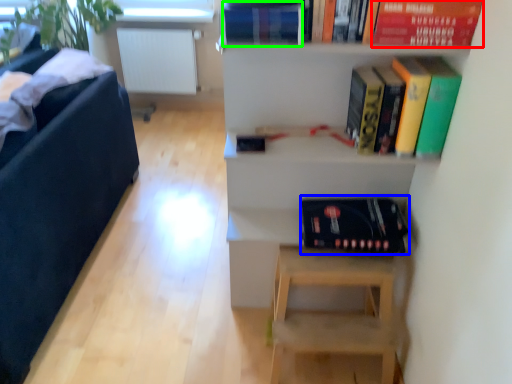
Question: Estimate the real-world distances between objects in this image. Which object is closer to paperback book (highlighted by a red box), album (highlighted by a blue box) or paperback book (highlighted by a green box)?

Choices:
 (A) album
 (B) paperback book

Answer: (B)